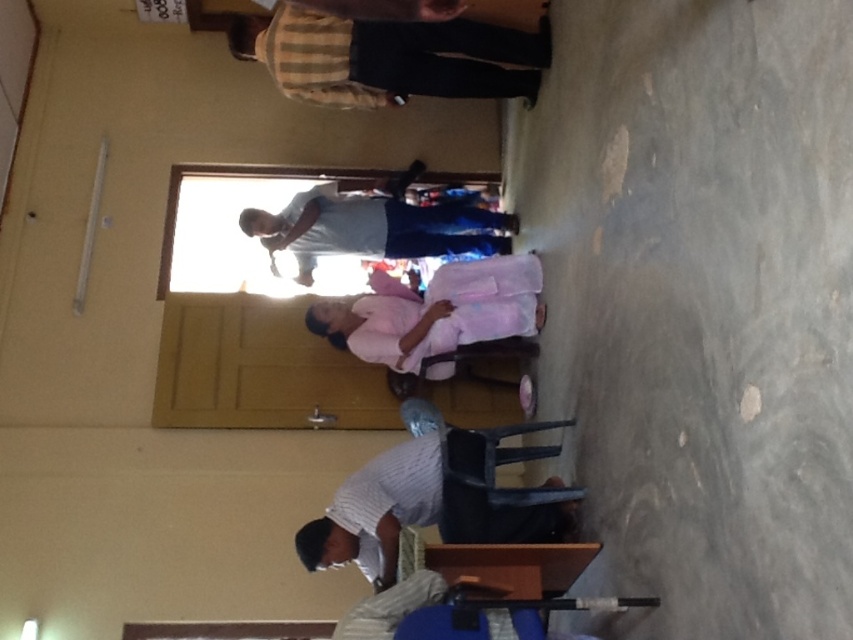
Question: Which of the following is the farthest from the observer?

Choices:
 (A) pink fabric at center
 (B) striped cotton shirt at upper center
 (C) matte gray shirt at center
 (D) striped fabric shirt at lower center

Answer: (C)

Question: Is striped cotton shirt at upper center above blue fabric stool at lower center?

Choices:
 (A) no
 (B) yes

Answer: (B)

Question: Which is nearer to the blue fabric stool at lower center?

Choices:
 (A) striped cotton shirt at upper center
 (B) matte gray shirt at center
 (C) pink fabric at center
 (D) striped fabric shirt at lower center

Answer: (D)

Question: Which object is the closest to the blue fabric stool at lower center?

Choices:
 (A) pink fabric at center
 (B) striped cotton shirt at upper center
 (C) striped fabric shirt at lower center
 (D) matte gray shirt at center

Answer: (C)

Question: Is striped fabric shirt at lower center to the left of blue fabric stool at lower center from the viewer's perspective?

Choices:
 (A) no
 (B) yes

Answer: (B)

Question: In this image, where is striped cotton shirt at upper center located relative to matte gray shirt at center?

Choices:
 (A) right
 (B) left

Answer: (A)